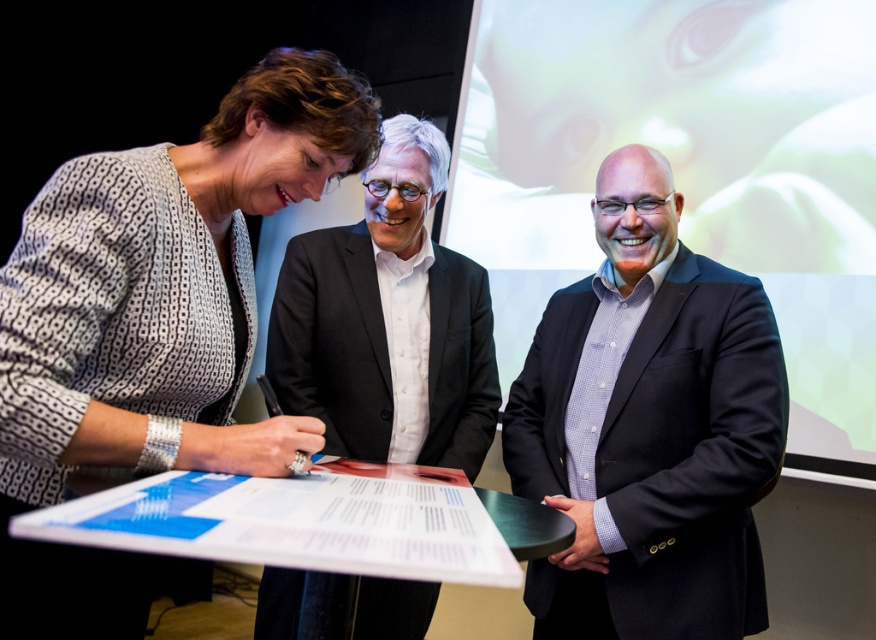
You are an event planner arranging seating for a formal dinner. You need to place a chair for the guest wearing the patterned fabric dress at left and another chair for the guest in the matte black suit at center. Based on their positions in the image, which guest should sit closer to the head table?

The patterned fabric dress at left should sit closer to the head table because it is positioned below the matte black suit at center, indicating a closer proximity to the front of the room.

You are standing in the conference room and see two points marked on the wall. The first point is at coordinates point (58,323) and the second point is at point (724,296). Which point is closer to you?

Point (58,323) is closer to the viewer than point (724,296).